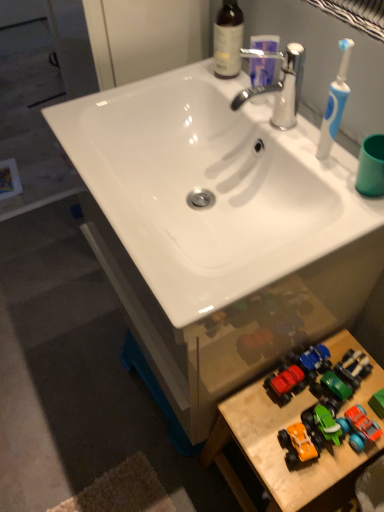
This screenshot has height=512, width=384. Identify the location of free region on the left part of orange matte toy car at lower right. click(256, 437).